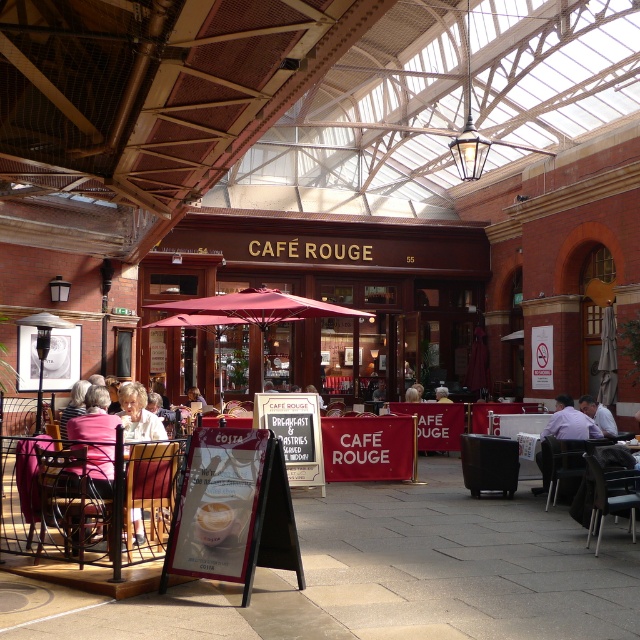
Who is positioned more to the right, wooden chair at left or matte black chair at center?

From the viewer's perspective, matte black chair at center appears more on the right side.

Between point (54, 544) and point (492, 490), which one is positioned in front?

Point (54, 544) is more forward.

Who is more forward, (44, 532) or (492, 452)?

Point (44, 532) is in front.

This screenshot has height=640, width=640. I want to click on wooden chair at left, so click(x=72, y=499).

Can you confirm if matte black chair at center is bigger than metallic silver chair at center?

No, matte black chair at center is not bigger than metallic silver chair at center.

Is point (493, 464) closer to camera compared to point (612, 493)?

No, (493, 464) is behind (612, 493).

Find the location of a particular element. The width and height of the screenshot is (640, 640). matte black chair at center is located at coordinates (488, 464).

Can you confirm if matte black chair at center is shorter than white fabric shirt at center?

No, matte black chair at center is not shorter than white fabric shirt at center.

Can you confirm if matte black chair at center is positioned below white fabric shirt at center?

Correct, matte black chair at center is located below white fabric shirt at center.

Who is more forward, (484, 490) or (166, 438)?

Point (166, 438) is more forward.

Image resolution: width=640 pixels, height=640 pixels. Find the location of `matte black chair at center`. matte black chair at center is located at coordinates (488, 464).